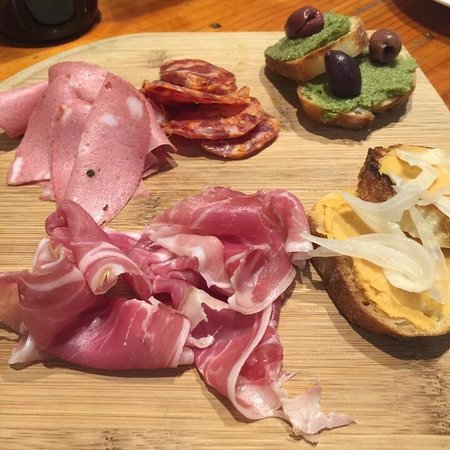
This screenshot has width=450, height=450. Identify the location of table. (434, 58), (187, 10), (11, 60).